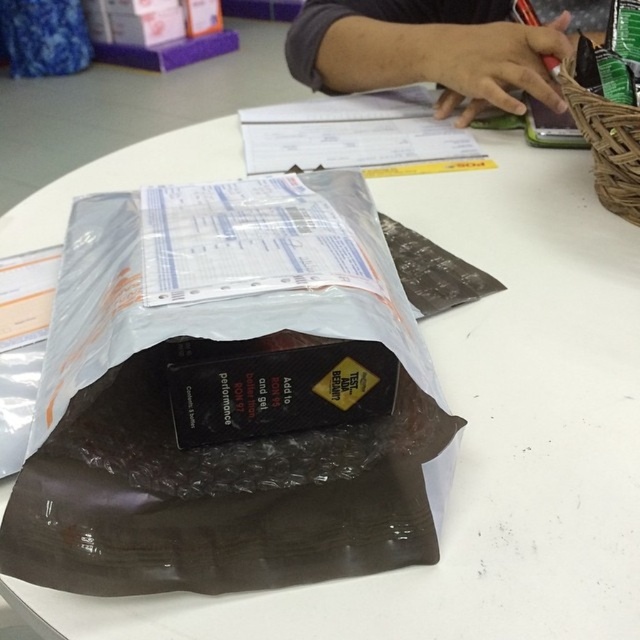
Can you confirm if dark gray skin at upper center is positioned above woven brown basket at upper right?

Correct, dark gray skin at upper center is located above woven brown basket at upper right.

Can you confirm if dark gray skin at upper center is positioned below woven brown basket at upper right?

No.

Between point (449, 58) and point (627, 189), which one is positioned in front?

Point (627, 189)

I want to click on dark gray skin at upper center, so click(426, 51).